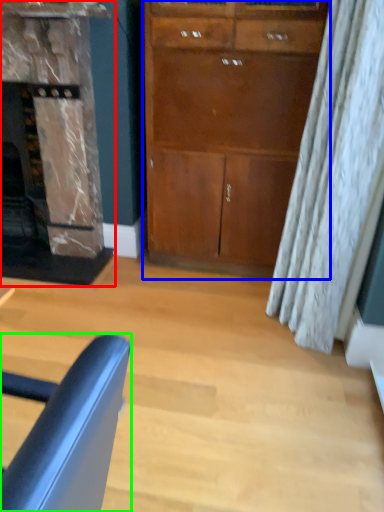
Question: Considering the real-world distances, which object is closest to fireplace (highlighted by a red box)? cabinetry (highlighted by a blue box) or chair (highlighted by a green box).

Choices:
 (A) cabinetry
 (B) chair

Answer: (A)